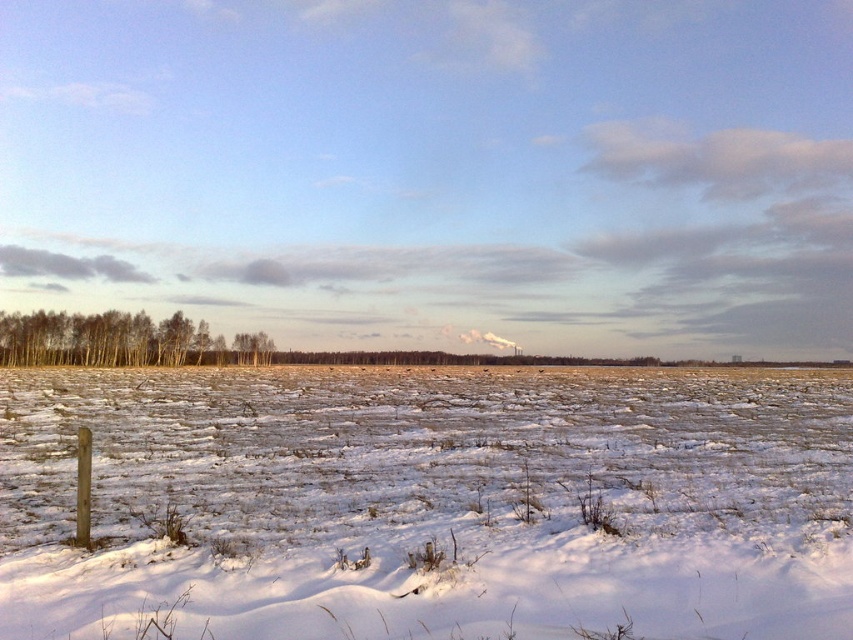
From the picture: You are a hiker trying to navigate through the snow in the winter landscape. You see the white powdery snow at lower left and the brown smooth trees at left. Which area is more likely to have a stable footing for walking?

The brown smooth trees at left are positioned above the white powdery snow at lower left, so the area near the trees might have deeper snow. The white powdery snow at lower left is under the trees, which could mean it is more compacted and stable for walking.